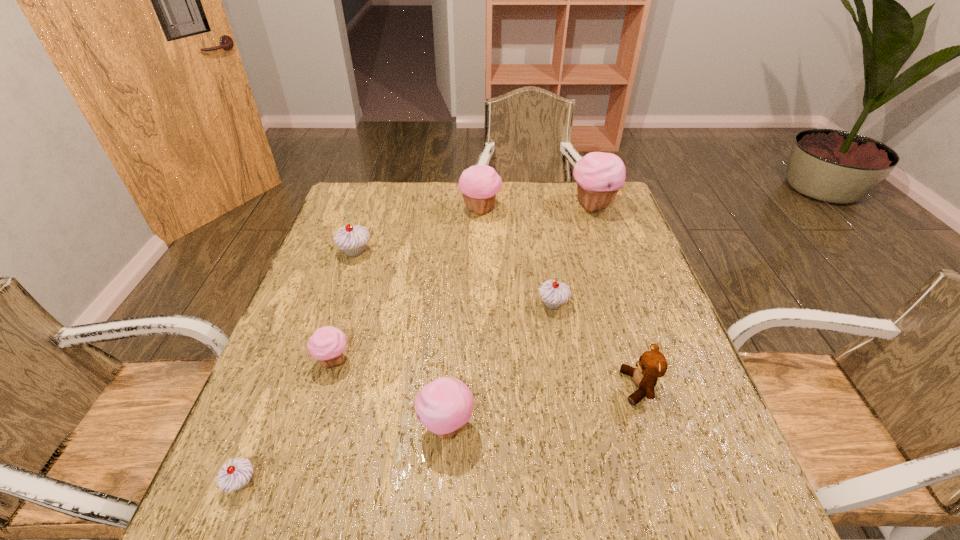
Where is `free space between the teddy bear and the fifth farthest cupcake`? free space between the teddy bear and the fifth farthest cupcake is located at coordinates (486, 374).

In order to click on free area in between the third smallest pink cupcake and the farthest gray cupcake in this screenshot , I will do `click(418, 231)`.

You are a GUI agent. You are given a task and a screenshot of the screen. Output one action in this format:
    pyautogui.click(x=<x>, y=<y>)
    Task: Click on the empty space that is in between the leftmost pink cupcake and the biggest pink cupcake
    This screenshot has width=960, height=540.
    Given the screenshot: What is the action you would take?
    pyautogui.click(x=464, y=284)

Find the location of a particular element. unoccupied position between the nearest cupcake and the tallest cupcake is located at coordinates (418, 344).

Identify which object is the fifth nearest to the third nearest cupcake. Please provide its 2D coordinates. Your answer should be formatted as a tuple, i.e. [(x, y)], where the tuple contains the x and y coordinates of a point satisfying the conditions above.

[(479, 184)]

Find the location of a particular element. This screenshot has height=540, width=960. object that is the fourth closest to the brown teddy bear is located at coordinates (327, 344).

The width and height of the screenshot is (960, 540). Find the location of `cupcake that is the fifth closest to the biggest gray cupcake`. cupcake that is the fifth closest to the biggest gray cupcake is located at coordinates (235, 475).

Identify which cupcake is the fourth nearest to the teddy bear. Please provide its 2D coordinates. Your answer should be formatted as a tuple, i.e. [(x, y)], where the tuple contains the x and y coordinates of a point satisfying the conditions above.

[(327, 344)]

Find the location of a particular element. This screenshot has width=960, height=540. pink cupcake that can be found as the closest to the second nearest pink cupcake is located at coordinates (443, 406).

Locate which pink cupcake is the second closest to the third smallest pink cupcake. Please provide its 2D coordinates. Your answer should be formatted as a tuple, i.e. [(x, y)], where the tuple contains the x and y coordinates of a point satisfying the conditions above.

[(327, 344)]